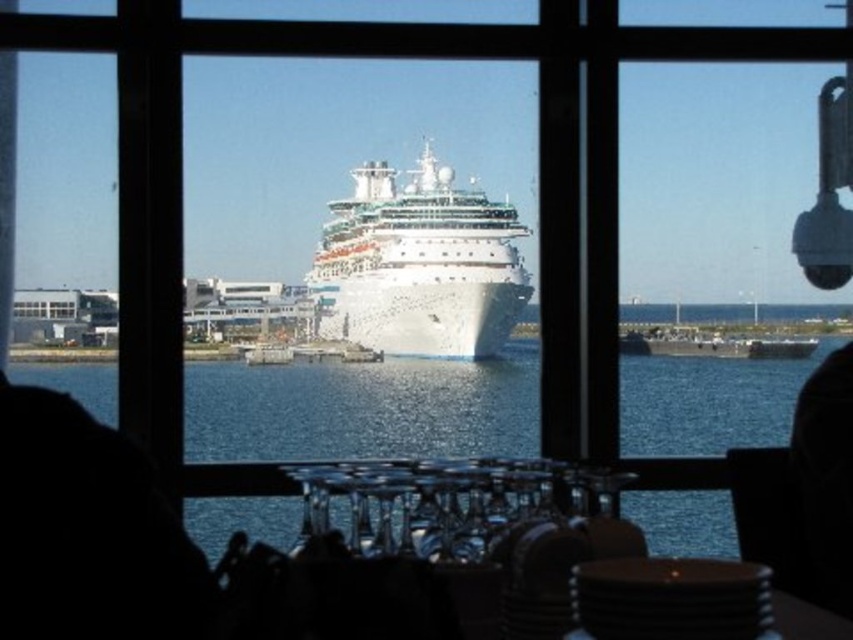
Who is more distant from viewer, (239, 438) or (480, 307)?

Point (480, 307)

Can you confirm if blue water at center is shorter than white glossy cruise ship at center?

Yes.

What do you see at coordinates (363, 408) in the screenshot? I see `blue water at center` at bounding box center [363, 408].

You are a GUI agent. You are given a task and a screenshot of the screen. Output one action in this format:
    pyautogui.click(x=<x>, y=<y>)
    Task: Click on the blue water at center
    The width and height of the screenshot is (853, 640).
    Given the screenshot: What is the action you would take?
    363,408